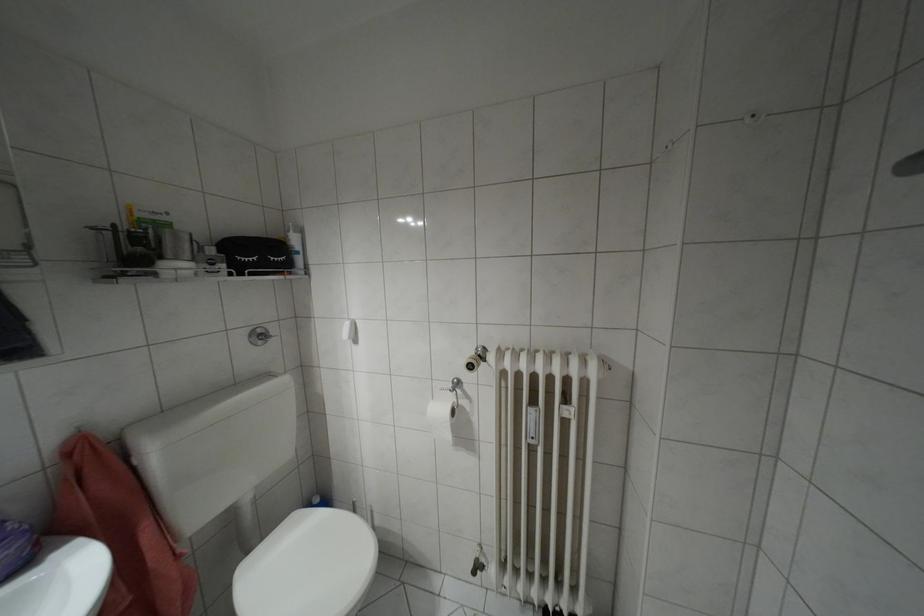
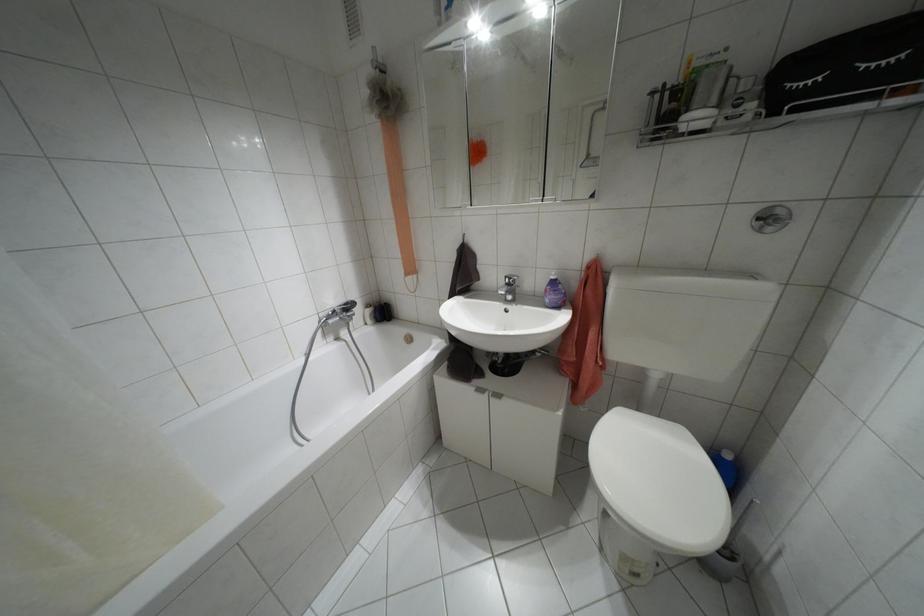
First-person continuous shooting, in which direction is the camera rotating?

The rotation direction of the camera is left-down.